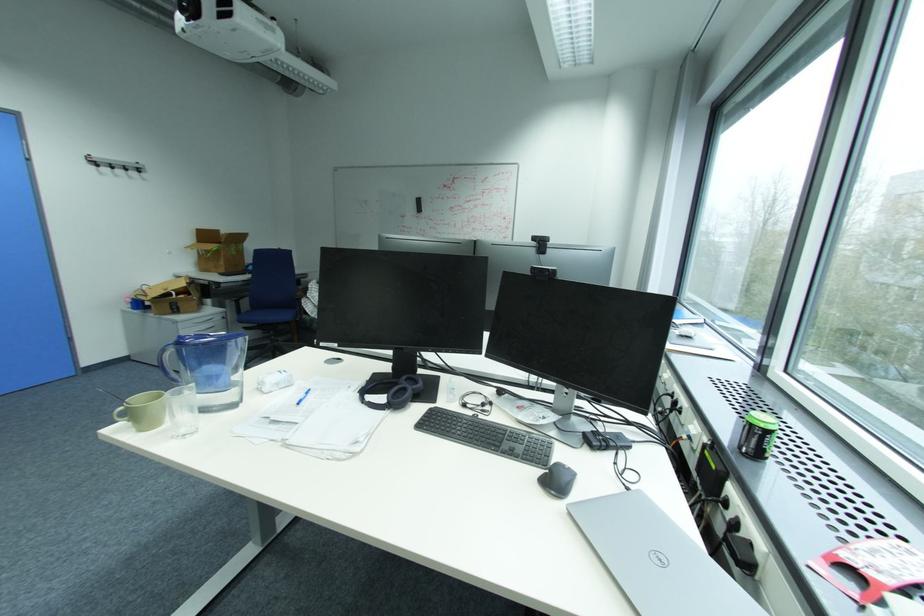
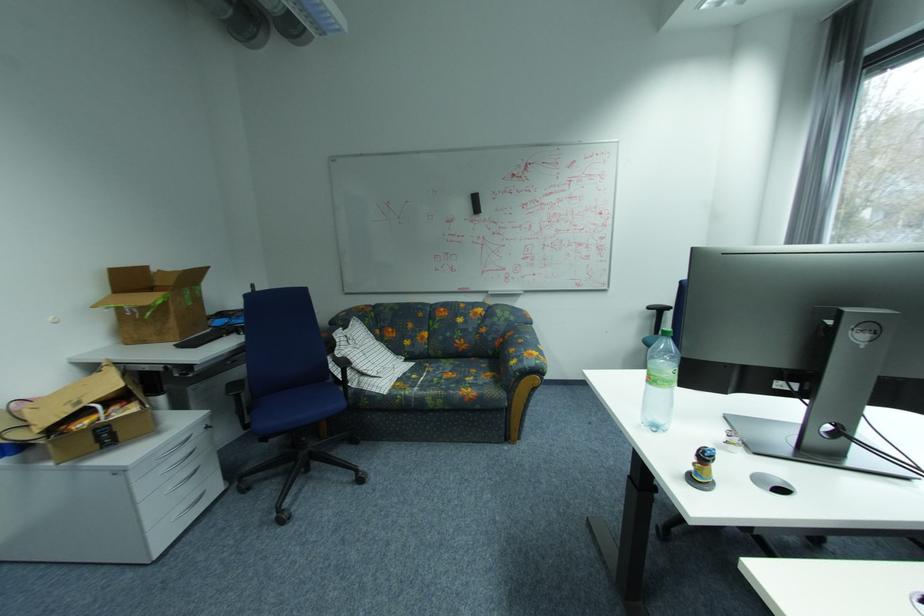
In the second image, find the point that corresponds to point (231, 264) in the first image.

(180, 323)